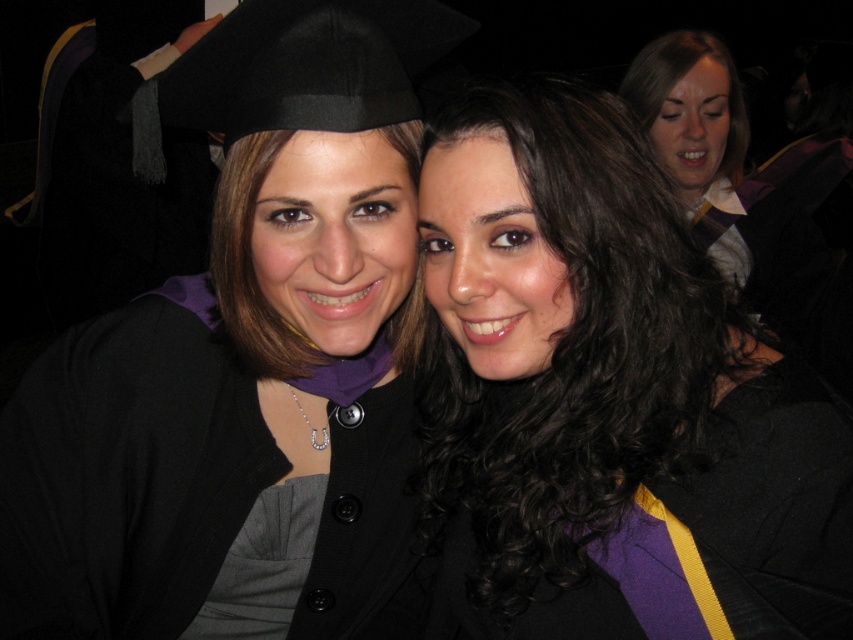
You are standing at the origin point in the image. Which of the two points, point (395, 426) or point (833, 488), is located behind the other?

Point (395, 426) is behind point (833, 488).

You are at a graduation ceremony and want to find the matte black graduation cap at upper left. According to the coordinates provided, where exactly should you look?

You should look at point (245, 371) to find the matte black graduation cap at upper left.